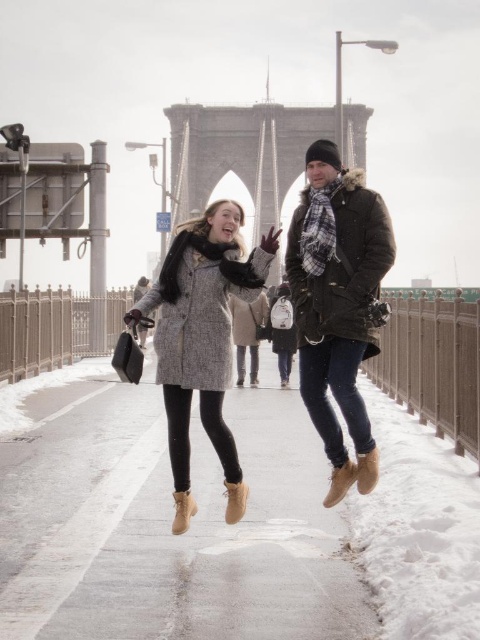
Question: Can you confirm if smooth concrete pavement at center is thinner than matte gray coat at center?

Choices:
 (A) yes
 (B) no

Answer: (B)

Question: Is smooth concrete pavement at center smaller than matte gray coat at center?

Choices:
 (A) yes
 (B) no

Answer: (B)

Question: Among these points, which one is farthest from the camera?

Choices:
 (A) (48, 508)
 (B) (320, 397)
 (C) (314, 362)

Answer: (C)

Question: Which object is closer to the camera taking this photo?

Choices:
 (A) smooth concrete pavement at center
 (B) textured gray coat at center

Answer: (A)

Question: Is smooth concrete pavement at center below textured gray coat at center?

Choices:
 (A) no
 (B) yes

Answer: (B)

Question: Among these objects, which one is nearest to the camera?

Choices:
 (A) brown woolen coat at center
 (B) matte gray coat at center
 (C) smooth concrete pavement at center

Answer: (C)